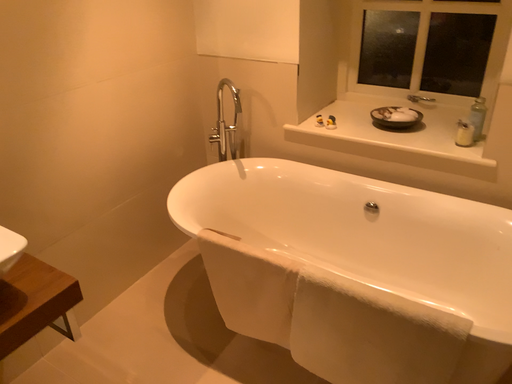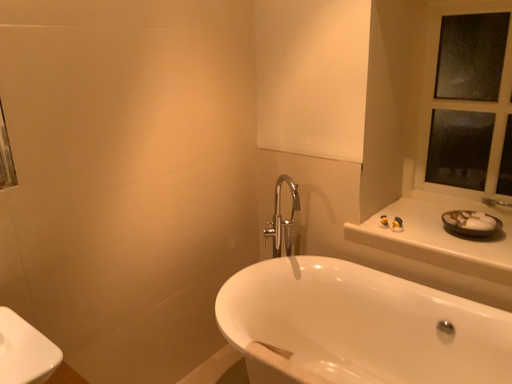
Question: Which way did the camera rotate in the video?

Choices:
 (A) rotated upward
 (B) rotated downward

Answer: (A)